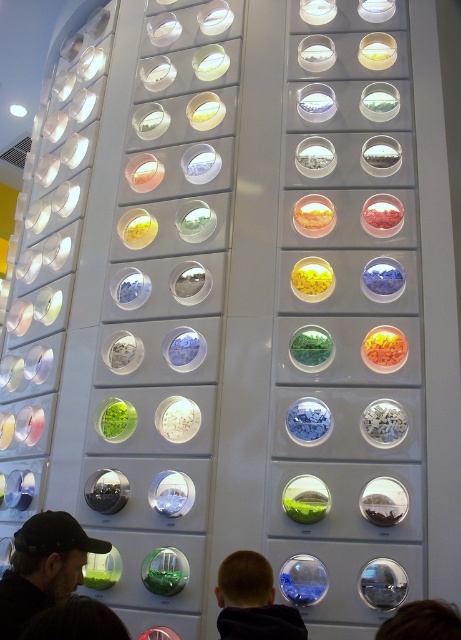
Question: Observing the image, what is the correct spatial positioning of dark brown leather cap at lower left in reference to brown hair at lower right?

Choices:
 (A) above
 (B) below

Answer: (B)

Question: Among these points, which one is farthest from the camera?

Choices:
 (A) (77, 604)
 (B) (429, 637)

Answer: (A)

Question: Is dark brown leather cap at lower left to the left of brown hair at lower right from the viewer's perspective?

Choices:
 (A) no
 (B) yes

Answer: (B)

Question: From the image, what is the correct spatial relationship of dark brown leather cap at lower left in relation to brown hair at lower right?

Choices:
 (A) right
 (B) left

Answer: (B)

Question: Which point appears closest to the camera in this image?

Choices:
 (A) (271, 595)
 (B) (35, 588)
 (C) (408, 632)

Answer: (C)

Question: Which object is farther from the camera taking this photo?

Choices:
 (A) brown hair at lower right
 (B) dark brown hair at lower left

Answer: (A)